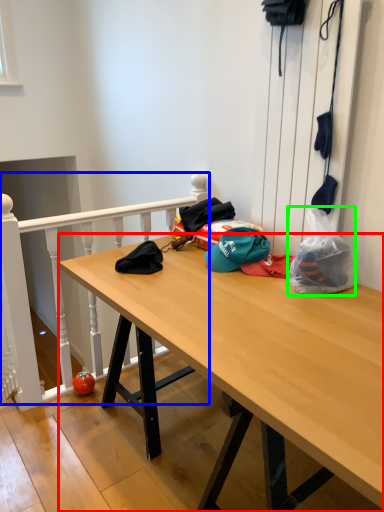
Question: Which object is the farthest from desk (highlighted by a red box)? Choose among these: rail (highlighted by a blue box) or plastic bag (highlighted by a green box).

Choices:
 (A) rail
 (B) plastic bag

Answer: (A)